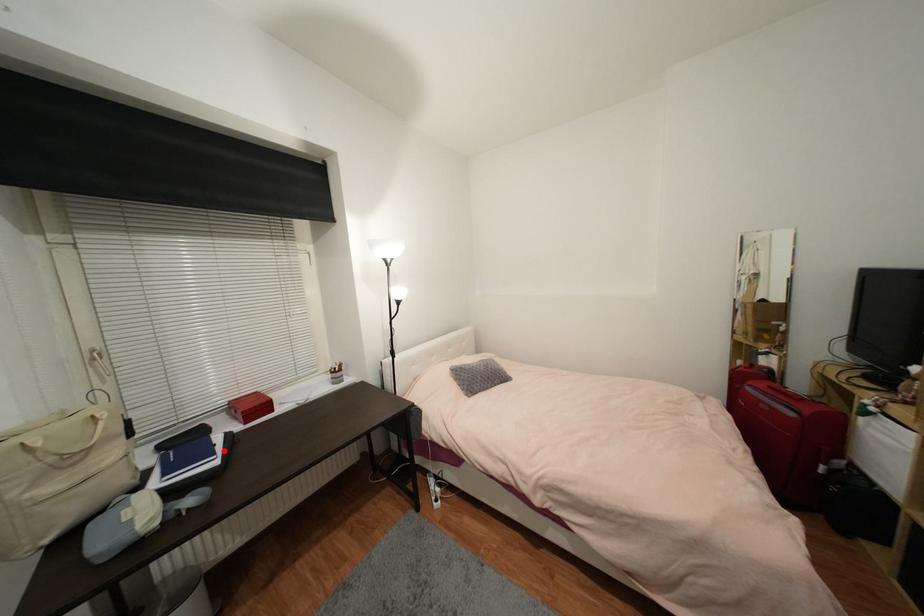
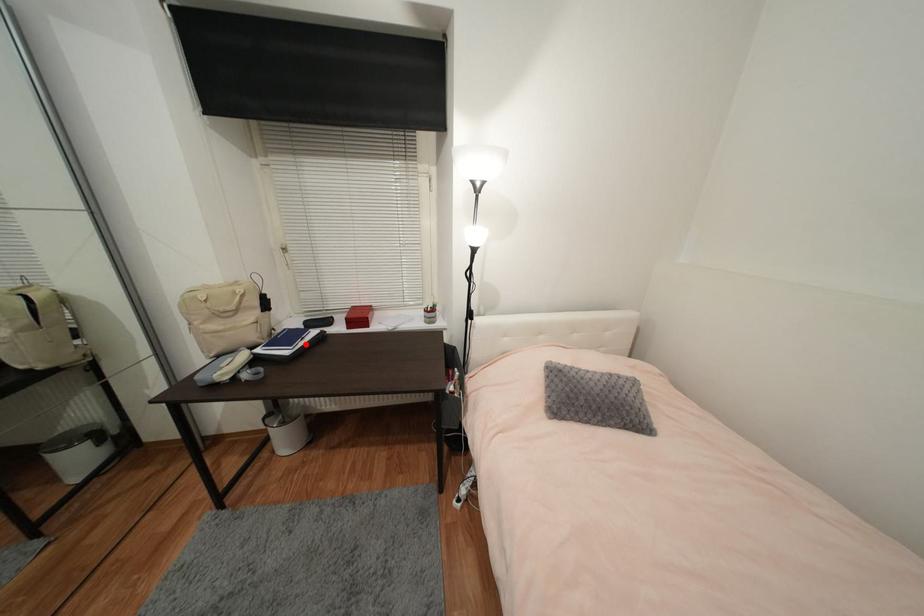
I am providing you with two images of the same scene from different viewpoints. A red point is marked on the first image and another point is marked on the second image. Does the point marked in image1 correspond to the same location as the one in image2?

Yes